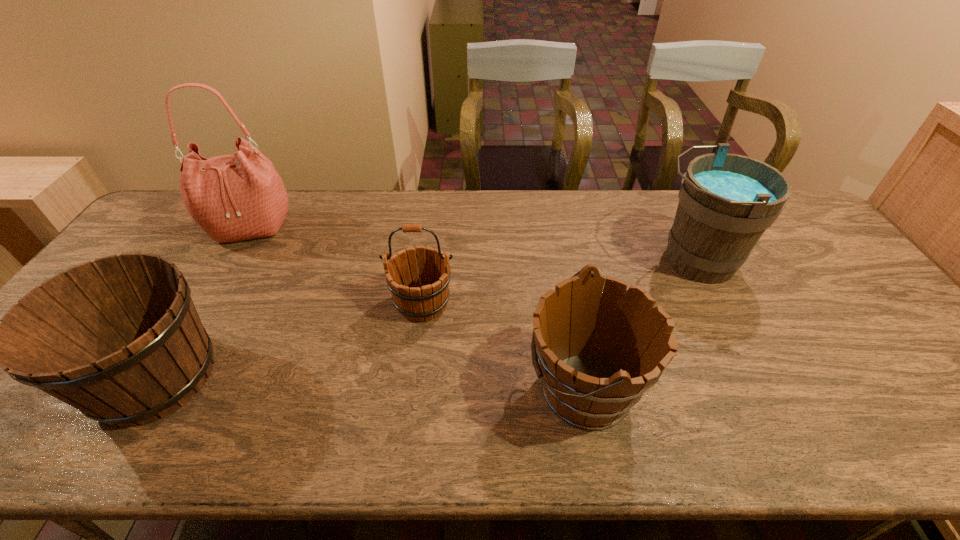
Image resolution: width=960 pixels, height=540 pixels. I want to click on vacant space located with the handle on the second wine bucket from right to left, so click(x=359, y=388).

Where is `vacant space located with the handle on the second wine bucket from right to left`? vacant space located with the handle on the second wine bucket from right to left is located at coordinates (368, 388).

Where is `vacant area located with the handle on the second wine bucket from right to left`? This screenshot has height=540, width=960. vacant area located with the handle on the second wine bucket from right to left is located at coordinates (395, 388).

This screenshot has height=540, width=960. What are the coordinates of `vacant region located 0.300m on the back of the leftmost wine bucket` in the screenshot? It's located at (233, 247).

Locate an element on the screen. handbag located in the far edge section of the desktop is located at coordinates (237, 197).

You are a GUI agent. You are given a task and a screenshot of the screen. Output one action in this format:
    pyautogui.click(x=<x>, y=<y>)
    Task: Click on the wine bucket located in the far edge section of the desktop
    Image resolution: width=960 pixels, height=540 pixels.
    Given the screenshot: What is the action you would take?
    pyautogui.click(x=726, y=201)

Image resolution: width=960 pixels, height=540 pixels. In order to click on object that is at the left edge in this screenshot , I will do `click(119, 338)`.

Find the location of a particular element. object that is positioned at the near left corner is located at coordinates (119, 338).

Locate an element on the screen. Image resolution: width=960 pixels, height=540 pixels. free space at the far edge of the desktop is located at coordinates (378, 218).

Locate an element on the screen. This screenshot has width=960, height=540. free region at the near edge is located at coordinates (423, 433).